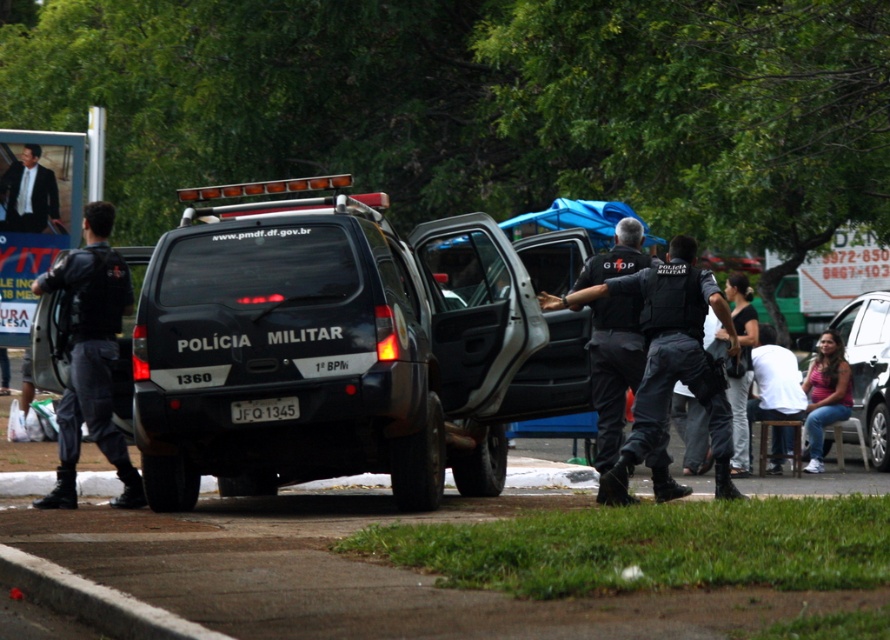
You are a photographer taking a picture of the scene. You need to ensure both the matte black vehicle at center and the pink fabric shirt at lower right are clearly visible. Given their widths, which object should you focus on first to ensure proper framing?

The matte black vehicle at center is wider than the pink fabric shirt at lower right. To ensure proper framing, focus on the wider matte black vehicle at center first, then adjust the camera to include the pink fabric shirt at lower right.

You are a witness describing the scene to a colleague. You need to mention the exact position of the matte black uniform at left. What coordinates should you report?

The matte black uniform at left is located at point [91,355].